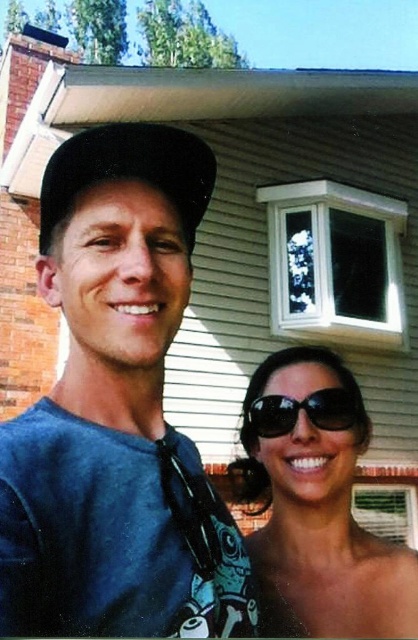
Question: Estimate the real-world distances between objects in this image. Which object is closer to the matte blue shirt at center?

Choices:
 (A) black reflective sunglasses at center
 (B) black matte baseball cap at upper left

Answer: (B)

Question: Which is nearer to the sunglasses at lower right?

Choices:
 (A) black reflective sunglasses at center
 (B) matte blue shirt at center
 (C) black matte baseball cap at upper left

Answer: (A)

Question: Estimate the real-world distances between objects in this image. Which object is closer to the sunglasses at lower right?

Choices:
 (A) black reflective sunglasses at center
 (B) matte blue shirt at center

Answer: (A)

Question: Can you confirm if matte blue shirt at center is positioned to the left of black matte baseball cap at upper left?

Choices:
 (A) yes
 (B) no

Answer: (B)

Question: Can you confirm if matte blue shirt at center is positioned below black reflective sunglasses at center?

Choices:
 (A) yes
 (B) no

Answer: (B)

Question: Is black matte baseball cap at upper left below black reflective sunglasses at center?

Choices:
 (A) no
 (B) yes

Answer: (A)